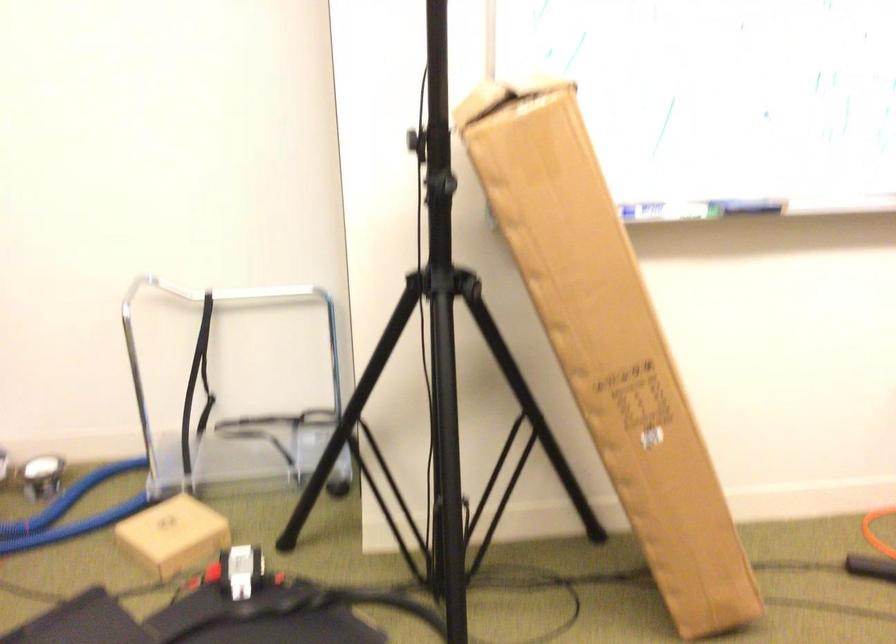
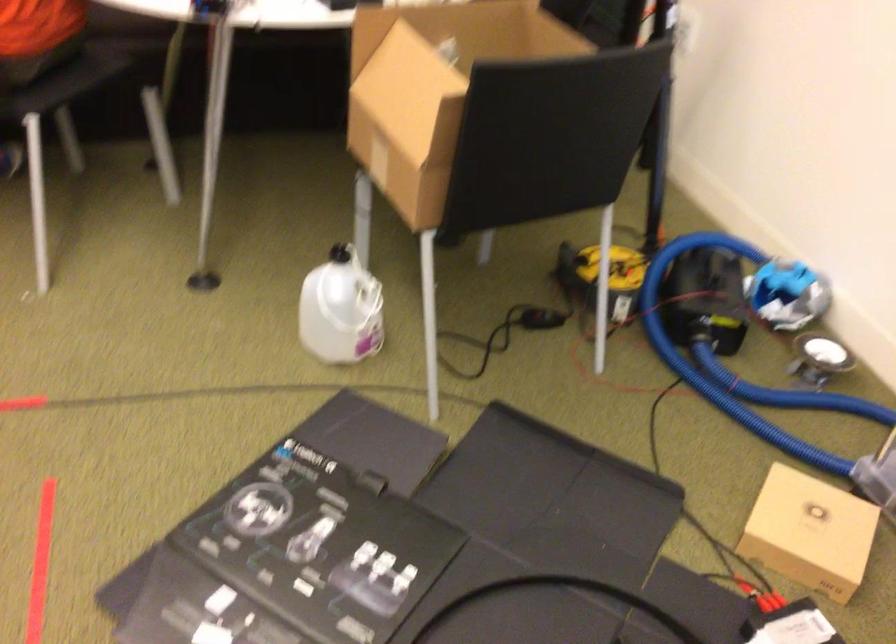
Locate, in the second image, the point that corresponds to pixel 183 529 in the first image.

(810, 532)